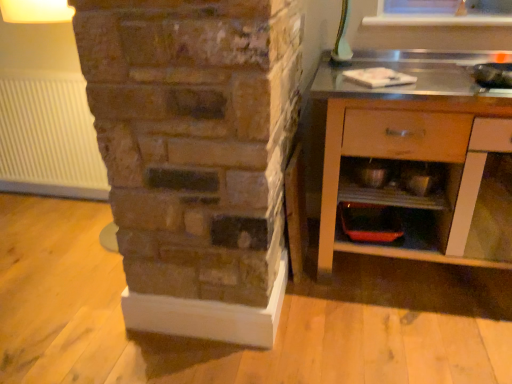
This screenshot has height=384, width=512. I want to click on free spot in front of wooden cabinet at right, so click(421, 335).